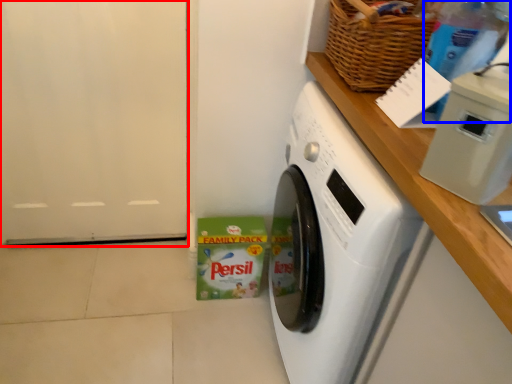
Question: Which point is further to the camera, door (highlighted by a red box) or bottle (highlighted by a blue box)?

Choices:
 (A) door
 (B) bottle

Answer: (A)